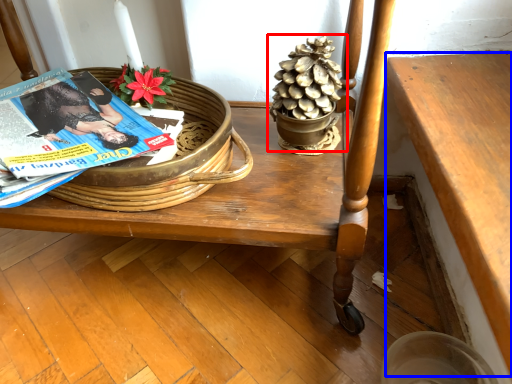
Question: Which object is closer to the camera taking this photo, houseplant (highlighted by a red box) or table (highlighted by a blue box)?

Choices:
 (A) houseplant
 (B) table

Answer: (B)